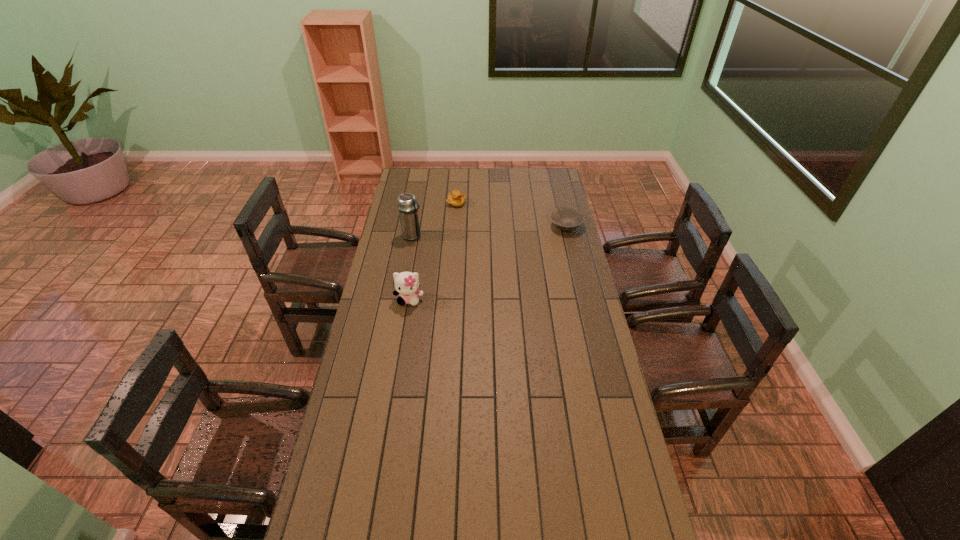
At what (x,y) coordinates should I click in order to perform the action: click on vacant area that lies between the tallest object and the bowl. Please return your answer as a coordinate pair (x, y). The height and width of the screenshot is (540, 960). Looking at the image, I should click on (490, 231).

The height and width of the screenshot is (540, 960). I want to click on unoccupied area between the bowl and the nearest object, so click(488, 263).

Identify the location of unoccupied area between the bowl and the third tallest object. coord(511,215).

At what (x,y) coordinates should I click in order to perform the action: click on the second closest object relative to the bowl. Please return your answer as a coordinate pair (x, y). Looking at the image, I should click on (408, 210).

Identify the location of the third closest object to the thermos bottle. (565, 218).